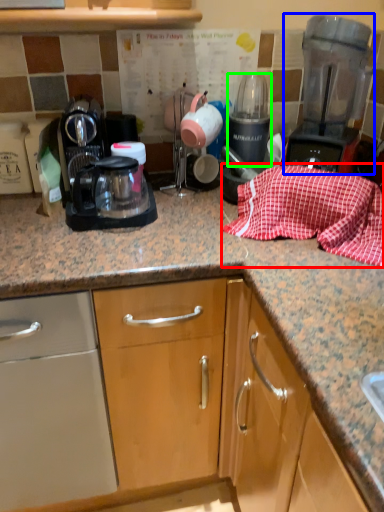
Question: Estimate the real-world distances between objects in this image. Which object is closer to blanket (highlighted by a red box), home appliance (highlighted by a blue box) or appliance (highlighted by a green box)?

Choices:
 (A) home appliance
 (B) appliance

Answer: (A)